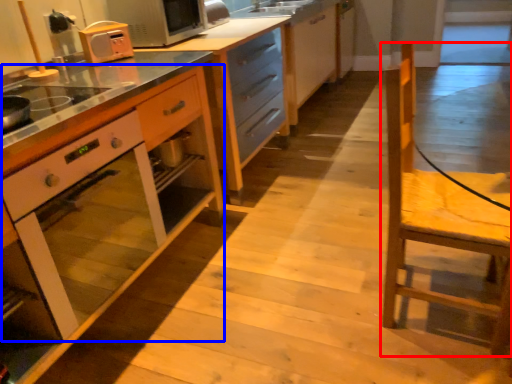
Question: Which object is closer to the camera taking this photo, chair (highlighted by a red box) or oven (highlighted by a blue box)?

Choices:
 (A) chair
 (B) oven

Answer: (B)